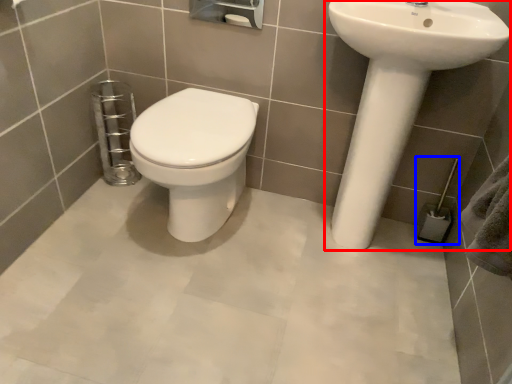
Question: Which point is closer to the camera, sink (highlighted by a red box) or towel bar (highlighted by a blue box)?

Choices:
 (A) sink
 (B) towel bar

Answer: (A)